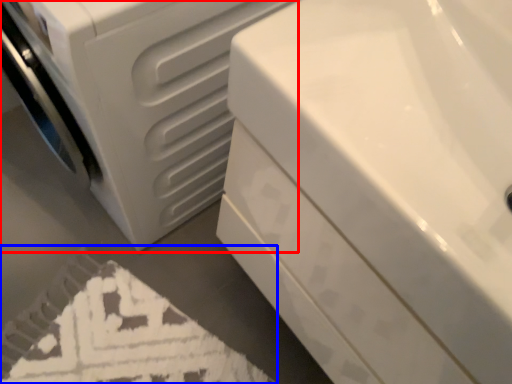
Question: Which object is further to the camera taking this photo, washing machine (highlighted by a red box) or bath mat (highlighted by a blue box)?

Choices:
 (A) washing machine
 (B) bath mat

Answer: (B)